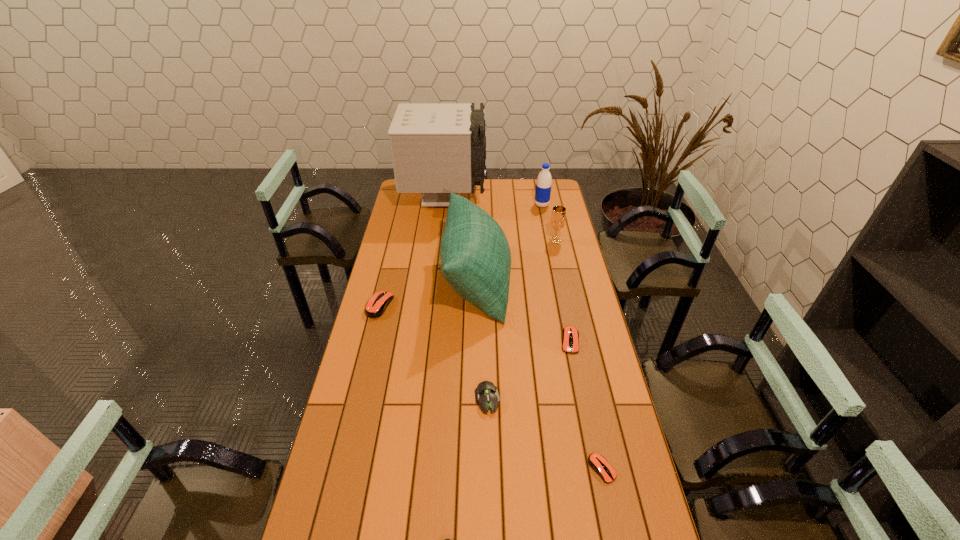
Identify the location of object that is the eighth closest one to the farthest computer mouse. The height and width of the screenshot is (540, 960). pos(543,186).

Identify the location of computer mouse that can be found as the closest to the farther gray computer mouse. The height and width of the screenshot is (540, 960). (570, 336).

You are a GUI agent. You are given a task and a screenshot of the screen. Output one action in this format:
    pyautogui.click(x=<x>, y=<y>)
    Task: Click on the closest computer mouse relative to the fourth tallest object
    This screenshot has width=960, height=540.
    Given the screenshot: What is the action you would take?
    pyautogui.click(x=570, y=336)

This screenshot has width=960, height=540. I want to click on the closest orange computer mouse relative to the left gray computer mouse, so click(x=597, y=462).

Where is `orange computer mouse object that ranks as the third closest to the left gray computer mouse`? The height and width of the screenshot is (540, 960). orange computer mouse object that ranks as the third closest to the left gray computer mouse is located at coordinates (376, 306).

This screenshot has height=540, width=960. I want to click on free space that satisfies the following two spatial constraints: 1. on the back side of the sixth farthest object; 2. on the left side of the bigger gray computer mouse, so click(x=487, y=341).

Where is `vacant area in the image that satisfies the following two spatial constraints: 1. on the back side of the nearest orange computer mouse; 2. on the right side of the chalice`? The height and width of the screenshot is (540, 960). vacant area in the image that satisfies the following two spatial constraints: 1. on the back side of the nearest orange computer mouse; 2. on the right side of the chalice is located at coordinates (554, 240).

Image resolution: width=960 pixels, height=540 pixels. What are the coordinates of `free space in the image that satisfies the following two spatial constraints: 1. on the back side of the chalice; 2. on the left side of the second nearest computer mouse` in the screenshot? It's located at (554, 240).

Find the location of a particular element. free location that satisfies the following two spatial constraints: 1. on the back side of the leftmost orange computer mouse; 2. on the left side of the third tallest object is located at coordinates (404, 205).